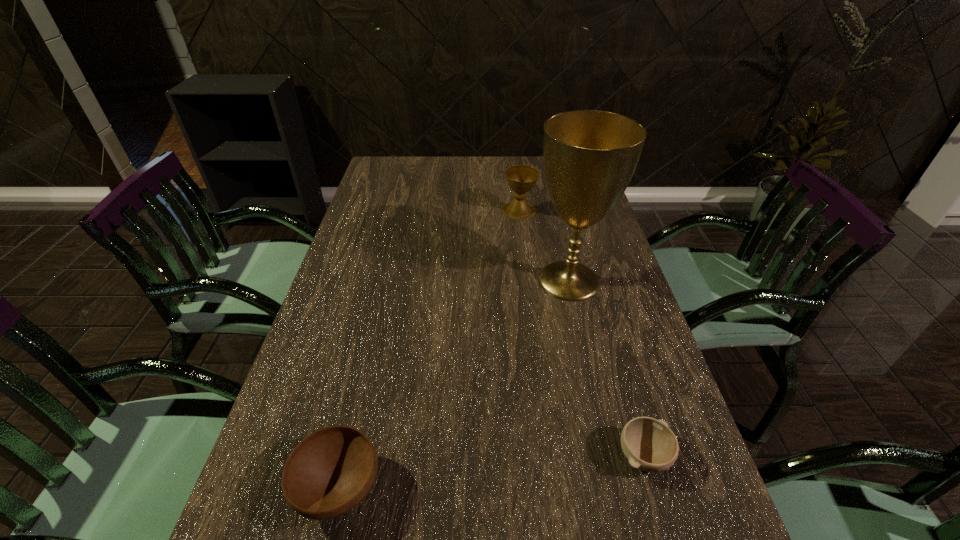
Where is `vacant space located on the back of the taller bowl`? Image resolution: width=960 pixels, height=540 pixels. vacant space located on the back of the taller bowl is located at coordinates (359, 403).

Identify the location of vacant position located on the back of the shortest object. (600, 306).

The width and height of the screenshot is (960, 540). Find the location of `object situated at the left edge`. object situated at the left edge is located at coordinates (330, 471).

Where is `trophy cup that is at the right edge`? This screenshot has width=960, height=540. trophy cup that is at the right edge is located at coordinates (590, 156).

Identify the location of bowl at the right edge. This screenshot has width=960, height=540. (649, 444).

At what (x,y) coordinates should I click in order to perform the action: click on free spot at the far edge of the desktop. Please return your answer as a coordinate pair (x, y). The image size is (960, 540). Looking at the image, I should click on (543, 185).

You are a GUI agent. You are given a task and a screenshot of the screen. Output one action in this format:
    pyautogui.click(x=<x>, y=<y>)
    Task: Click on the free point at the left edge
    Image resolution: width=960 pixels, height=540 pixels.
    Given the screenshot: What is the action you would take?
    pyautogui.click(x=342, y=252)

The image size is (960, 540). In the image, there is a desktop. What are the coordinates of `vacant space at the far left corner` in the screenshot? It's located at (414, 157).

Where is `vacant point located between the taller bowl and the right bowl`? vacant point located between the taller bowl and the right bowl is located at coordinates [x=492, y=472].

The width and height of the screenshot is (960, 540). What are the coordinates of `unoccupied area between the third tallest object and the shorter bowl` in the screenshot? It's located at (492, 472).